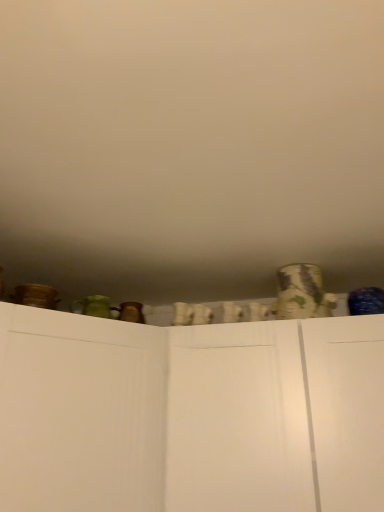
Question: Considering the positions of patterned ceramic vase at upper right and white matte cupboard at center in the image, is patterned ceramic vase at upper right taller or shorter than white matte cupboard at center?

Choices:
 (A) short
 (B) tall

Answer: (A)

Question: In the image, is patterned ceramic vase at upper right on the left side or the right side of white matte cupboard at center?

Choices:
 (A) left
 (B) right

Answer: (B)

Question: Which object is the farthest from the white matte wall at upper center?

Choices:
 (A) patterned ceramic vase at upper right
 (B) white matte cupboard at center

Answer: (A)

Question: Which object is the closest to the patterned ceramic vase at upper right?

Choices:
 (A) white matte cupboard at center
 (B) white matte wall at upper center

Answer: (A)